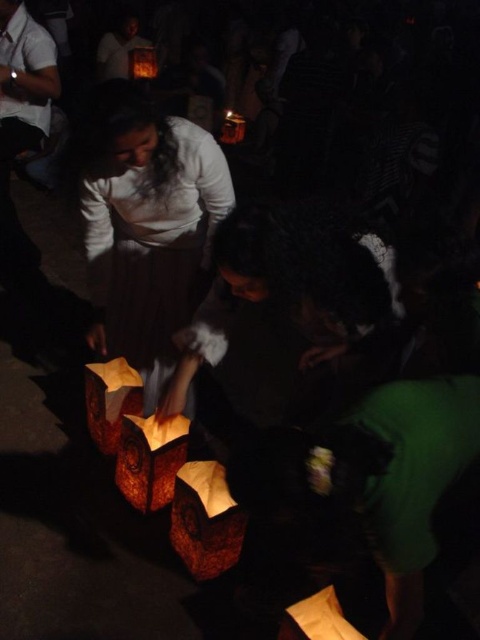
Between matte brown paper lantern at center and brown paper lantern at center, which one appears on the left side from the viewer's perspective?

brown paper lantern at center

In the scene shown: Can you confirm if matte brown paper lantern at center is thinner than brown paper lantern at center?

Incorrect, matte brown paper lantern at center's width is not less than brown paper lantern at center's.

I want to click on matte brown paper lantern at center, so click(149, 460).

Can you confirm if matte white blouse at center is positioned to the left of brown paper lantern at center?

Incorrect, matte white blouse at center is not on the left side of brown paper lantern at center.

From the picture: Can you confirm if matte white blouse at center is smaller than brown paper lantern at center?

Actually, matte white blouse at center might be larger than brown paper lantern at center.

Which is in front, point (144, 250) or point (124, 392)?

Positioned in front is point (144, 250).

At what (x,y) coordinates should I click in order to perform the action: click on matte white blouse at center. Please return your answer as a coordinate pair (x, y). This screenshot has height=640, width=480. Looking at the image, I should click on (147, 227).

Between point (219, 540) and point (231, 134), which one is positioned in front?

Positioned in front is point (219, 540).

This screenshot has width=480, height=640. In order to click on rustic paper lantern at center in this screenshot , I will do `click(205, 518)`.